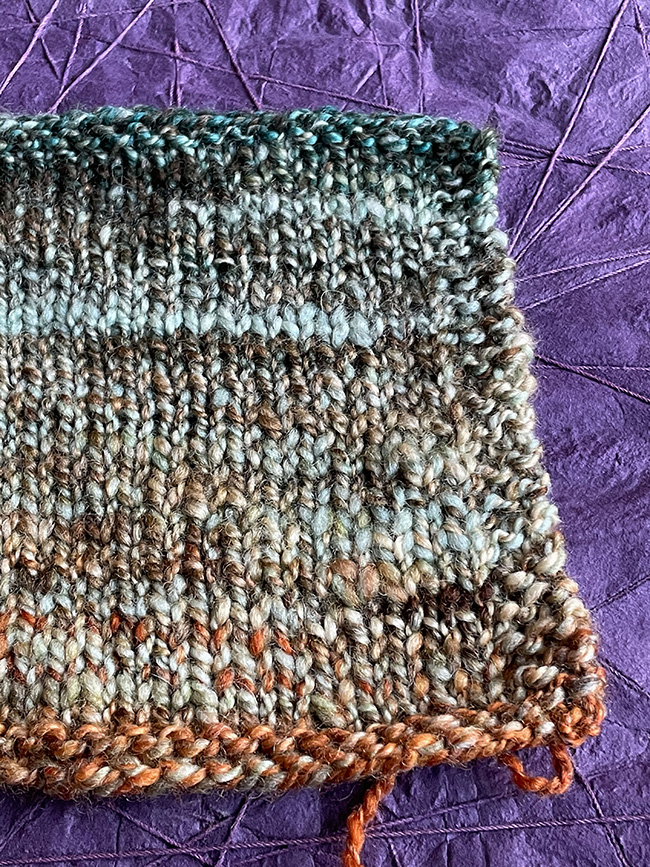
Locate an element on the screen. This screenshot has height=867, width=650. purple fabric is located at coordinates (617, 550), (621, 799), (42, 839).